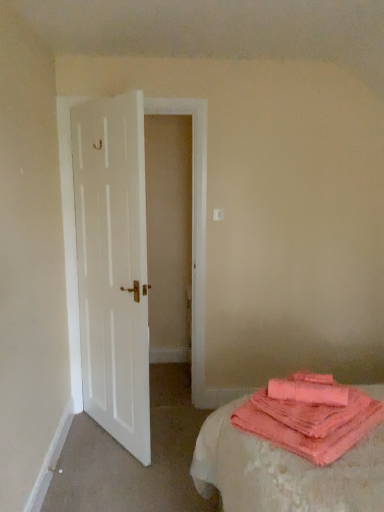
Question: Can you confirm if coral soft towel at lower right is wider than coral terry cloth at lower right?

Choices:
 (A) no
 (B) yes

Answer: (A)

Question: From the image's perspective, would you say coral soft towel at lower right is shown under coral terry cloth at lower right?

Choices:
 (A) yes
 (B) no

Answer: (B)

Question: Is coral soft towel at lower right far away from coral terry cloth at lower right?

Choices:
 (A) no
 (B) yes

Answer: (A)

Question: Is coral terry cloth at lower right a part of coral soft towel at lower right?

Choices:
 (A) no
 (B) yes

Answer: (A)

Question: Can you confirm if coral soft towel at lower right is smaller than coral terry cloth at lower right?

Choices:
 (A) yes
 (B) no

Answer: (A)

Question: Does point (91, 142) appear closer or farther from the camera than point (306, 453)?

Choices:
 (A) closer
 (B) farther

Answer: (B)

Question: Is white wooden door at left inside or outside of coral terry cloth at lower right?

Choices:
 (A) outside
 (B) inside

Answer: (A)

Question: Considering the positions of white wooden door at left and coral terry cloth at lower right in the image, is white wooden door at left wider or thinner than coral terry cloth at lower right?

Choices:
 (A) thin
 (B) wide

Answer: (A)

Question: In the image, is white wooden door at left positioned in front of or behind coral terry cloth at lower right?

Choices:
 (A) behind
 (B) front

Answer: (A)

Question: From the image's perspective, is coral terry cloth at lower right above or below coral soft towel at lower right?

Choices:
 (A) below
 (B) above

Answer: (A)

Question: In the image, is coral terry cloth at lower right positioned in front of or behind coral soft towel at lower right?

Choices:
 (A) behind
 (B) front

Answer: (B)

Question: Is coral terry cloth at lower right wider or thinner than coral soft towel at lower right?

Choices:
 (A) wide
 (B) thin

Answer: (A)

Question: Is coral terry cloth at lower right bigger or smaller than coral soft towel at lower right?

Choices:
 (A) small
 (B) big

Answer: (B)

Question: In the image, is coral terry cloth at lower right on the left side or the right side of white wooden door at left?

Choices:
 (A) right
 (B) left

Answer: (A)

Question: Is coral terry cloth at lower right inside or outside of white wooden door at left?

Choices:
 (A) outside
 (B) inside

Answer: (A)